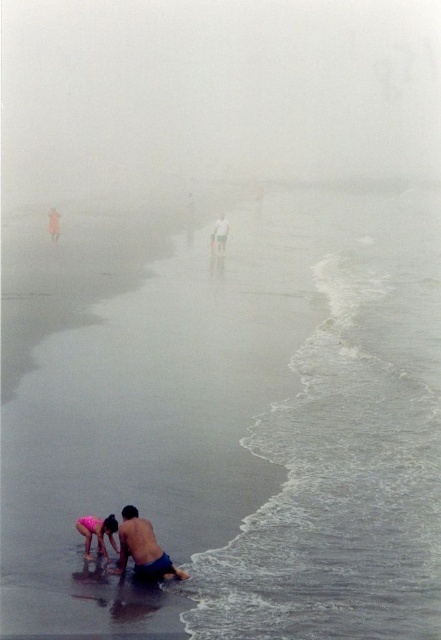
You are a photographer trying to capture the scene. You notice the foggy white at upper center and the smooth white man at center. Which object in the scene occupies a larger area in the image?

The foggy white at upper center is bigger than the smooth white man at center, so it occupies a larger area in the image.

You are a photographer standing at the edge of the beach, and you want to take a photo that includes both the pink fabric at lower left and the smooth white man at center. Given that your camera has a maximum focus range of 100 feet, will you be able to capture both subjects in focus without moving your position?

The pink fabric at lower left and smooth white man at center are 95.83 feet apart. Since the distance between them is within the camera maximum focus range of 100 feet, you can capture both subjects in focus without moving.